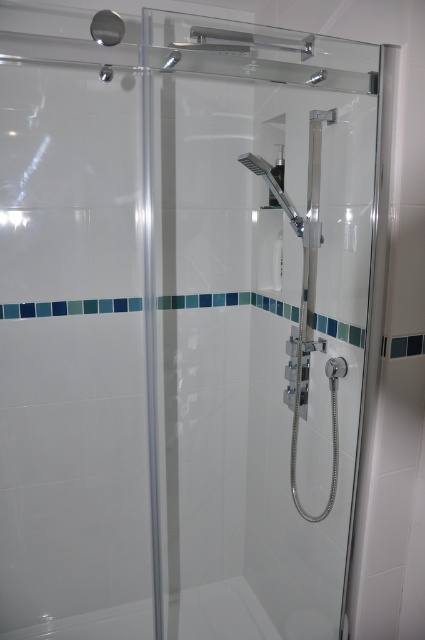
Who is positioned more to the right, white glossy bath at lower center or chrome metallic shower head at upper center?

Positioned to the right is chrome metallic shower head at upper center.

Does white glossy bath at lower center have a larger size compared to chrome metallic shower head at upper center?

Correct, white glossy bath at lower center is larger in size than chrome metallic shower head at upper center.

At what (x,y) coordinates should I click in order to perform the action: click on white glossy bath at lower center. Please return your answer as a coordinate pair (x, y). The height and width of the screenshot is (640, 425). Looking at the image, I should click on (223, 612).